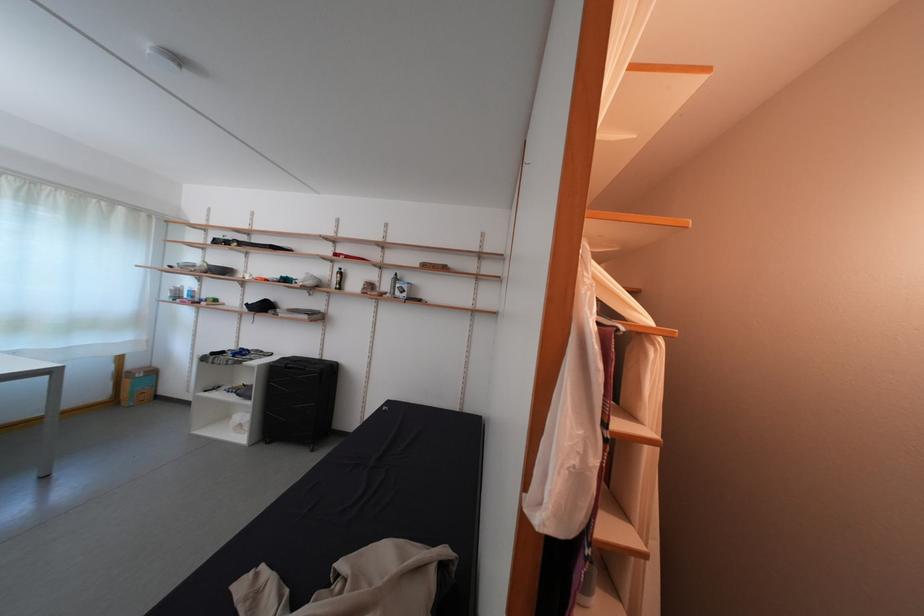
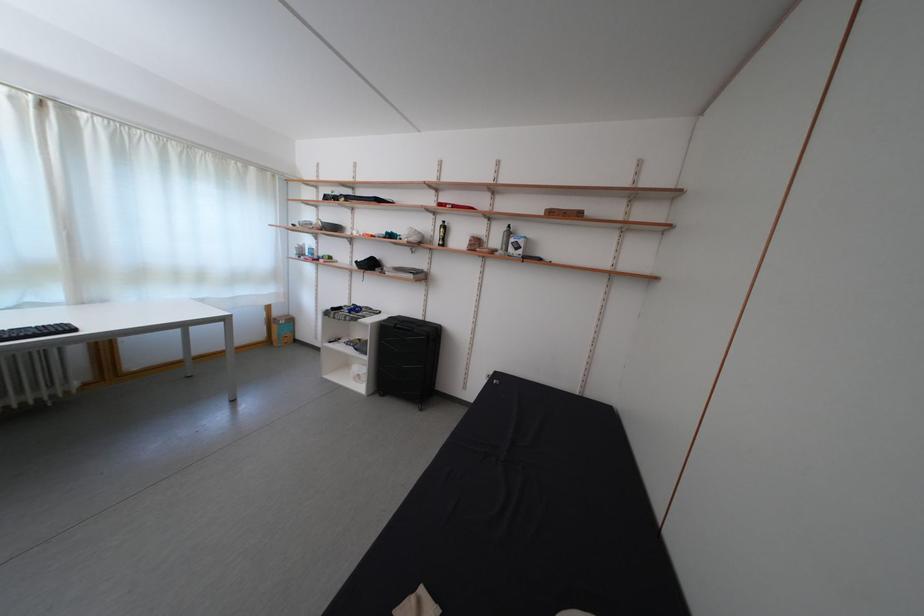
Where in the second image is the point corresponding to (x=339, y=286) from the first image?

(442, 241)